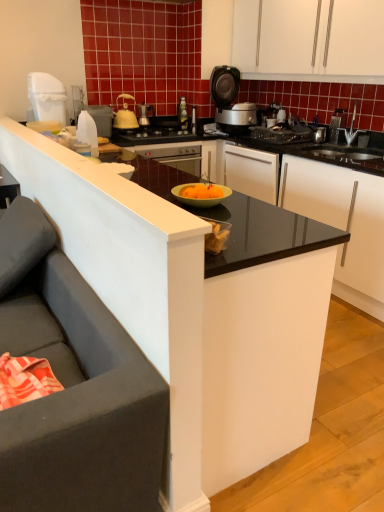
Question: Does white plastic bottle at left, which is the fourth kitchen appliance from back to front, have a greater width compared to white plastic trash can at upper left, the first kitchen appliance from the left?

Choices:
 (A) yes
 (B) no

Answer: (B)

Question: From the image's perspective, is white plastic bottle at left, the first kitchen appliance from the front, over white plastic trash can at upper left, which ranks as the fourth kitchen appliance in right-to-left order?

Choices:
 (A) no
 (B) yes

Answer: (A)

Question: From a real-world perspective, does white plastic bottle at left, which is the fourth kitchen appliance from back to front, stand above white plastic trash can at upper left, the first kitchen appliance from the left?

Choices:
 (A) yes
 (B) no

Answer: (B)

Question: Is white plastic bottle at left, marked as the 3th kitchen appliance in a right-to-left arrangement, behind white plastic trash can at upper left, acting as the 2th kitchen appliance starting from the front?

Choices:
 (A) no
 (B) yes

Answer: (A)

Question: Is white plastic bottle at left, arranged as the 2th kitchen appliance when viewed from the left, positioned far away from white plastic trash can at upper left, which ranks as the fourth kitchen appliance in right-to-left order?

Choices:
 (A) no
 (B) yes

Answer: (A)

Question: Is white plastic bottle at left, arranged as the 2th kitchen appliance when viewed from the left, taller or shorter than dark gray fabric studio couch at left?

Choices:
 (A) tall
 (B) short

Answer: (B)

Question: Relative to dark gray fabric studio couch at left, is white plastic bottle at left, the first kitchen appliance from the front, in front or behind?

Choices:
 (A) front
 (B) behind

Answer: (B)

Question: Based on their positions, is white plastic bottle at left, marked as the 3th kitchen appliance in a right-to-left arrangement, located to the left or right of dark gray fabric studio couch at left?

Choices:
 (A) right
 (B) left

Answer: (A)

Question: From a real-world perspective, is white plastic bottle at left, marked as the 3th kitchen appliance in a right-to-left arrangement, positioned above or below dark gray fabric studio couch at left?

Choices:
 (A) above
 (B) below

Answer: (A)

Question: Is black glossy countertop at center taller or shorter than white matte cabinet at upper center?

Choices:
 (A) short
 (B) tall

Answer: (B)

Question: Is black glossy countertop at center bigger or smaller than white matte cabinet at upper center?

Choices:
 (A) big
 (B) small

Answer: (A)

Question: Is point (266, 308) positioned closer to the camera than point (382, 52)?

Choices:
 (A) farther
 (B) closer

Answer: (B)

Question: From the image's perspective, is black glossy countertop at center positioned above or below white matte cabinet at upper center?

Choices:
 (A) below
 (B) above

Answer: (A)

Question: From a real-world perspective, is white matte cabinet at upper center physically located above or below yellow matte kettle at upper center, the 3th kitchen appliance when ordered from left to right?

Choices:
 (A) above
 (B) below

Answer: (A)

Question: Does point (281, 8) appear closer or farther from the camera than point (117, 121)?

Choices:
 (A) farther
 (B) closer

Answer: (B)